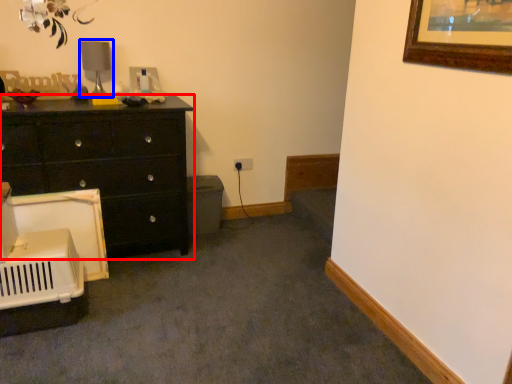
Question: Among these objects, which one is farthest to the camera, chest of drawers (highlighted by a red box) or table lamp (highlighted by a blue box)?

Choices:
 (A) chest of drawers
 (B) table lamp

Answer: (B)